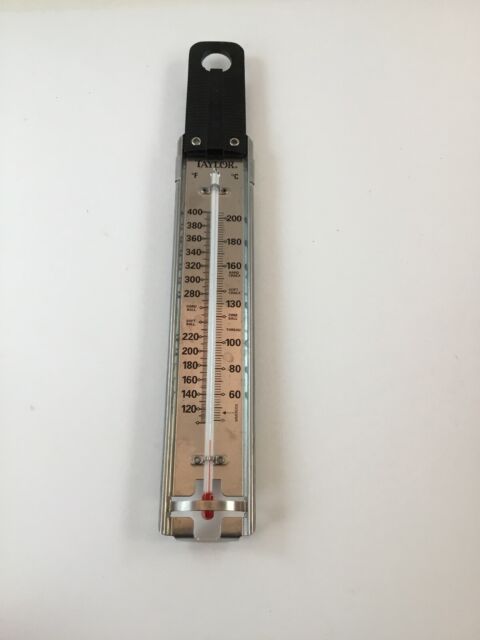
You are a GUI agent. You are given a task and a screenshot of the screen. Output one action in this format:
    pyautogui.click(x=<x>, y=<y>)
    Task: Click on the thermostat
    The image size is (480, 640).
    Given the screenshot: What is the action you would take?
    pyautogui.click(x=217, y=109)